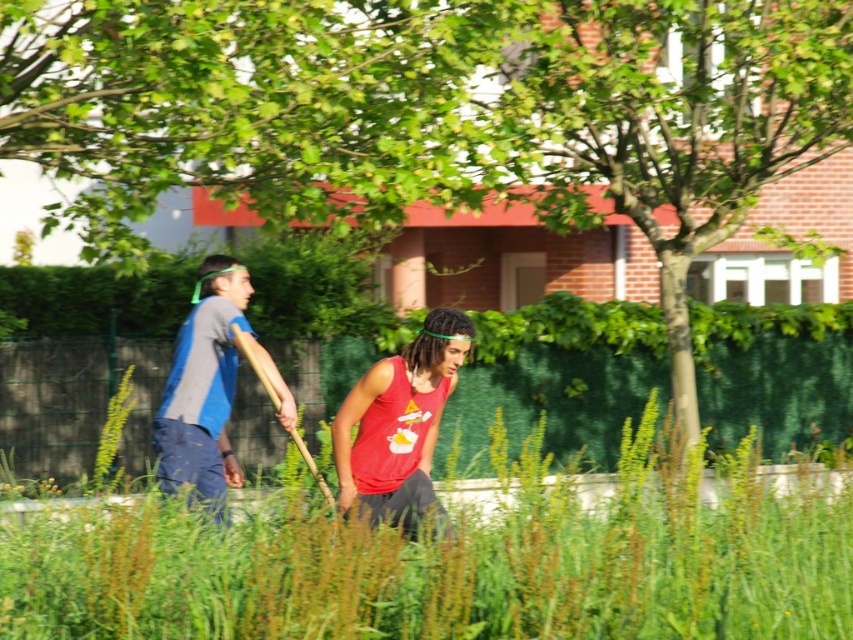
Question: Among these points, which one is farthest from the camera?

Choices:
 (A) (393, 588)
 (B) (372, 497)
 (C) (218, 288)

Answer: (C)

Question: Estimate the real-world distances between objects in this image. Which object is farther from the matte red tank top at center?

Choices:
 (A) green grass at center
 (B) blue fabric shirt at left

Answer: (B)

Question: Can you confirm if green grass at center is smaller than blue fabric shirt at left?

Choices:
 (A) yes
 (B) no

Answer: (B)

Question: Does green grass at center have a greater width compared to blue fabric shirt at left?

Choices:
 (A) no
 (B) yes

Answer: (B)

Question: Is green grass at center wider than blue fabric shirt at left?

Choices:
 (A) no
 (B) yes

Answer: (B)

Question: Which point appears closest to the camera in this image?

Choices:
 (A) (410, 406)
 (B) (683, 508)

Answer: (B)